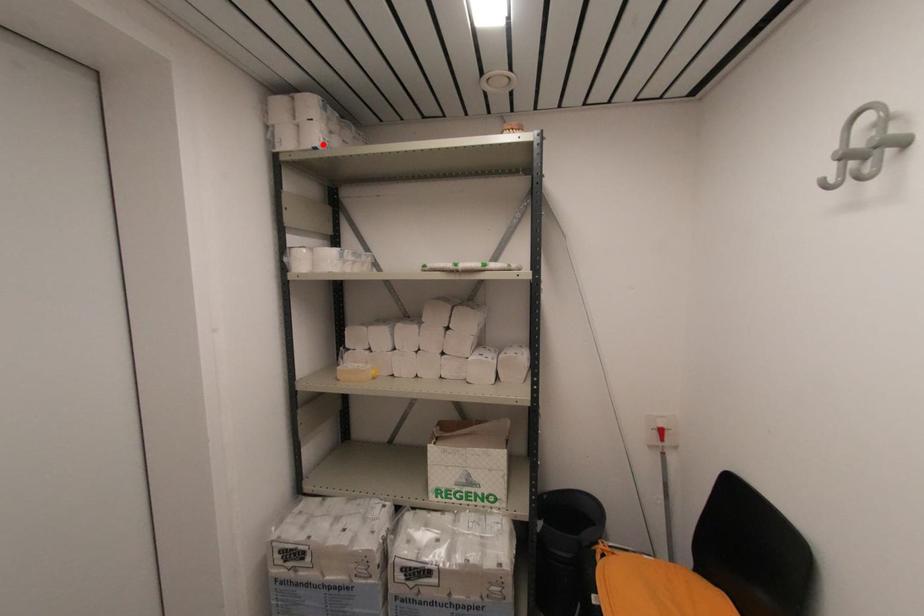
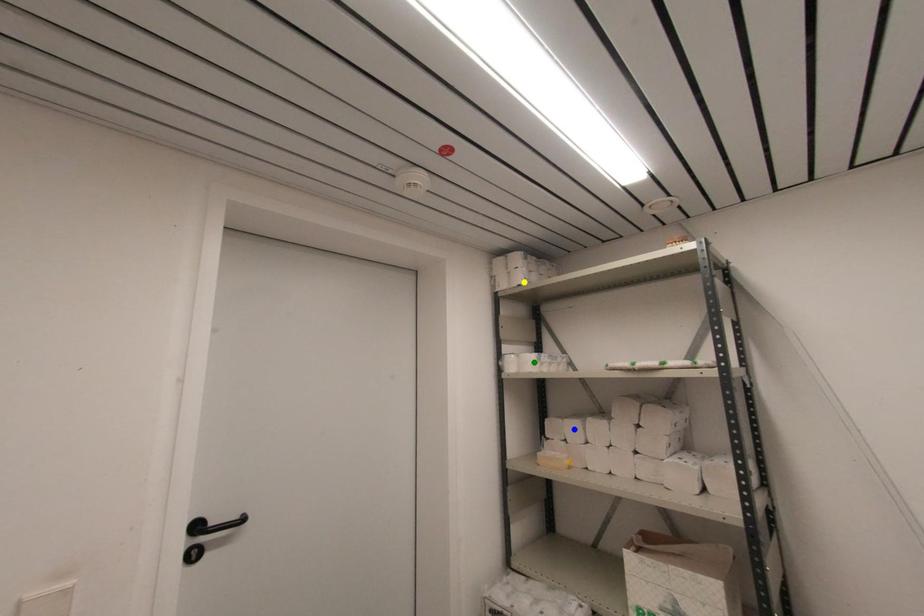
Question: I am providing you with two images of the same scene from different viewpoints. A red point is marked on the first image. You are given multiple points on the second image. In image 2, which mark is for the same physical point as the one in image 1?

Choices:
 (A) green point
 (B) yellow point
 (C) blue point

Answer: (B)